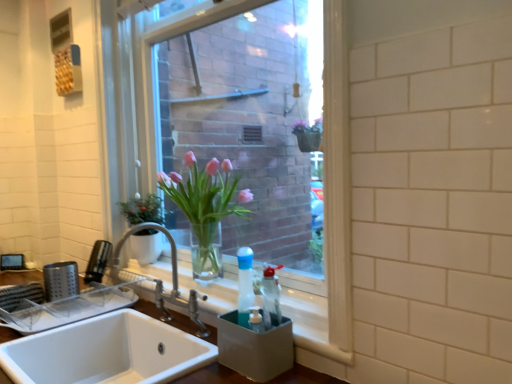
Question: Is white ceramic sink at lower left, placed as the second sink when sorted from top to bottom, positioned beyond the bounds of pink glass vase at center?

Choices:
 (A) no
 (B) yes

Answer: (B)

Question: Is white ceramic sink at lower left, which is the first sink in bottom-to-top order, with pink glass vase at center?

Choices:
 (A) yes
 (B) no

Answer: (B)

Question: Considering the relative sizes of white ceramic sink at lower left, placed as the second sink when sorted from top to bottom, and pink glass vase at center in the image provided, is white ceramic sink at lower left, placed as the second sink when sorted from top to bottom, taller than pink glass vase at center?

Choices:
 (A) yes
 (B) no

Answer: (A)

Question: Is white ceramic sink at lower left, placed as the second sink when sorted from top to bottom, oriented towards pink glass vase at center?

Choices:
 (A) no
 (B) yes

Answer: (A)

Question: Can you confirm if white ceramic sink at lower left, which is the first sink in bottom-to-top order, is shorter than pink glass vase at center?

Choices:
 (A) no
 (B) yes

Answer: (A)

Question: Is clear glass vase at center situated inside white ceramic sink at lower left, the second sink when ordered from bottom to top, or outside?

Choices:
 (A) outside
 (B) inside

Answer: (A)

Question: Does point (295, 66) appear closer or farther from the camera than point (92, 349)?

Choices:
 (A) farther
 (B) closer

Answer: (A)

Question: From the image's perspective, relative to white ceramic sink at lower left, the second sink when ordered from bottom to top, is clear glass vase at center above or below?

Choices:
 (A) below
 (B) above

Answer: (B)

Question: In terms of width, does clear glass vase at center look wider or thinner when compared to white ceramic sink at lower left, acting as the first sink starting from the top?

Choices:
 (A) wide
 (B) thin

Answer: (B)

Question: Is pink glass vase at center to the left or to the right of white ceramic sink at lower left, the second sink when ordered from bottom to top, in the image?

Choices:
 (A) right
 (B) left

Answer: (A)

Question: From their relative heights in the image, would you say pink glass vase at center is taller or shorter than white ceramic sink at lower left, the second sink when ordered from bottom to top?

Choices:
 (A) tall
 (B) short

Answer: (A)

Question: Is pink glass vase at center inside or outside of white ceramic sink at lower left, the second sink when ordered from bottom to top?

Choices:
 (A) inside
 (B) outside

Answer: (B)

Question: Based on their sizes in the image, would you say pink glass vase at center is bigger or smaller than white ceramic sink at lower left, acting as the first sink starting from the top?

Choices:
 (A) big
 (B) small

Answer: (B)

Question: From their relative heights in the image, would you say satin nickel faucet at sink left is taller or shorter than white ceramic sink at lower left, placed as the second sink when sorted from top to bottom?

Choices:
 (A) tall
 (B) short

Answer: (B)

Question: Is satin nickel faucet at sink left inside the boundaries of white ceramic sink at lower left, which is the first sink in bottom-to-top order, or outside?

Choices:
 (A) inside
 (B) outside

Answer: (B)